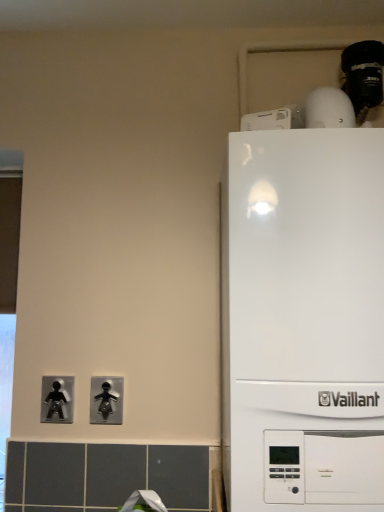
What do you see at coordinates (303, 320) in the screenshot? The image size is (384, 512). I see `white glossy boiler at right` at bounding box center [303, 320].

What do you see at coordinates (57, 399) in the screenshot? I see `metallic silver figure at lower left, arranged as the 2th light switch when viewed from the right` at bounding box center [57, 399].

Locate an element on the screen. metallic silver figure at lower left, which is the 1th light switch in left-to-right order is located at coordinates (57, 399).

At what (x,y) coordinates should I click in order to perform the action: click on black plastic light switch at lower center, the second light switch from the left. Please return your answer as a coordinate pair (x, y). This screenshot has width=384, height=512. Looking at the image, I should click on (106, 400).

Where is `white glossy boiler at right`? Image resolution: width=384 pixels, height=512 pixels. white glossy boiler at right is located at coordinates (303, 320).

Between metallic silver figure at lower left, arranged as the 2th light switch when viewed from the right, and black plastic light switch at lower center, the second light switch from the left, which one has more height?

metallic silver figure at lower left, arranged as the 2th light switch when viewed from the right.

Is black plastic light switch at lower center, the second light switch from the left, at the back of metallic silver figure at lower left, arranged as the 2th light switch when viewed from the right?

That's not correct — metallic silver figure at lower left, arranged as the 2th light switch when viewed from the right, is not looking away from black plastic light switch at lower center, the second light switch from the left.

In the scene shown: From a real-world perspective, is metallic silver figure at lower left, which is the 1th light switch in left-to-right order, located higher than black plastic light switch at lower center, the second light switch from the left?

Yes, from a real-world perspective, metallic silver figure at lower left, which is the 1th light switch in left-to-right order, is over black plastic light switch at lower center, the second light switch from the left

Is metallic silver figure at lower left, which is the 1th light switch in left-to-right order, far from black plastic light switch at lower center, which is the first light switch in right-to-left order?

They are positioned close to each other.

Consider the image. Is black plastic light switch at lower center, the second light switch from the left, looking in the opposite direction of metallic silver figure at lower left, arranged as the 2th light switch when viewed from the right?

No, black plastic light switch at lower center, the second light switch from the left, is not facing away from metallic silver figure at lower left, arranged as the 2th light switch when viewed from the right.

Considering the sizes of objects black plastic light switch at lower center, which is the first light switch in right-to-left order, and metallic silver figure at lower left, arranged as the 2th light switch when viewed from the right, in the image provided, who is bigger, black plastic light switch at lower center, which is the first light switch in right-to-left order, or metallic silver figure at lower left, arranged as the 2th light switch when viewed from the right,?

metallic silver figure at lower left, arranged as the 2th light switch when viewed from the right, is bigger.

Who is taller, black plastic light switch at lower center, which is the first light switch in right-to-left order, or metallic silver figure at lower left, which is the 1th light switch in left-to-right order?

With more height is metallic silver figure at lower left, which is the 1th light switch in left-to-right order.

Is black plastic light switch at lower center, which is the first light switch in right-to-left order, not inside metallic silver figure at lower left, arranged as the 2th light switch when viewed from the right?

Absolutely, black plastic light switch at lower center, which is the first light switch in right-to-left order, is external to metallic silver figure at lower left, arranged as the 2th light switch when viewed from the right.

Do you think white glossy boiler at right is within metallic silver figure at lower left, which is the 1th light switch in left-to-right order, or outside of it?

white glossy boiler at right is spatially situated outside metallic silver figure at lower left, which is the 1th light switch in left-to-right order.

At what (x,y) coordinates should I click in order to perform the action: click on the 2nd light switch behind when counting from the white glossy boiler at right. Please return your answer as a coordinate pair (x, y). Looking at the image, I should click on (57, 399).

From a real-world perspective, which object rests below the other?

From a 3D spatial view, metallic silver figure at lower left, arranged as the 2th light switch when viewed from the right, is below.

Considering the relative positions of white glossy boiler at right and metallic silver figure at lower left, which is the 1th light switch in left-to-right order, in the image provided, is white glossy boiler at right to the left of metallic silver figure at lower left, which is the 1th light switch in left-to-right order, from the viewer's perspective?

In fact, white glossy boiler at right is to the right of metallic silver figure at lower left, which is the 1th light switch in left-to-right order.

How far apart are metallic silver figure at lower left, which is the 1th light switch in left-to-right order, and white glossy boiler at right?

metallic silver figure at lower left, which is the 1th light switch in left-to-right order, is 25.44 inches away from white glossy boiler at right.

Considering the relative sizes of metallic silver figure at lower left, arranged as the 2th light switch when viewed from the right, and white glossy boiler at right in the image provided, is metallic silver figure at lower left, arranged as the 2th light switch when viewed from the right, thinner than white glossy boiler at right?

Correct, the width of metallic silver figure at lower left, arranged as the 2th light switch when viewed from the right, is less than that of white glossy boiler at right.

From a real-world perspective, is metallic silver figure at lower left, which is the 1th light switch in left-to-right order, physically located above or below white glossy boiler at right?

From a real-world perspective, metallic silver figure at lower left, which is the 1th light switch in left-to-right order, is physically below white glossy boiler at right.

Is metallic silver figure at lower left, arranged as the 2th light switch when viewed from the right, bigger than white glossy boiler at right?

No, metallic silver figure at lower left, arranged as the 2th light switch when viewed from the right, is not bigger than white glossy boiler at right.

Is white glossy boiler at right looking in the opposite direction of black plastic light switch at lower center, the second light switch from the left?

No, white glossy boiler at right's orientation is not away from black plastic light switch at lower center, the second light switch from the left.

Is white glossy boiler at right bigger than black plastic light switch at lower center, the second light switch from the left?

Yes.

Between white glossy boiler at right and black plastic light switch at lower center, the second light switch from the left, which one appears on the right side from the viewer's perspective?

From the viewer's perspective, white glossy boiler at right appears more on the right side.

Between black plastic light switch at lower center, the second light switch from the left, and white glossy boiler at right, which one is positioned in front?

white glossy boiler at right is closer to the camera.

From a real-world perspective, which object rests below the other?

black plastic light switch at lower center, the second light switch from the left.

Is black plastic light switch at lower center, the second light switch from the left, spatially inside white glossy boiler at right, or outside of it?

black plastic light switch at lower center, the second light switch from the left, exists outside the volume of white glossy boiler at right.

Find the location of a particular element. light switch above the black plastic light switch at lower center, the second light switch from the left (from a real-world perspective) is located at coordinates (57, 399).

I want to click on light switch to the right of metallic silver figure at lower left, arranged as the 2th light switch when viewed from the right, so click(106, 400).

Based on their spatial positions, is black plastic light switch at lower center, the second light switch from the left, or metallic silver figure at lower left, which is the 1th light switch in left-to-right order, closer to white glossy boiler at right?

black plastic light switch at lower center, the second light switch from the left, is positioned closer to the anchor white glossy boiler at right.

When comparing their distances from white glossy boiler at right, does metallic silver figure at lower left, which is the 1th light switch in left-to-right order, or black plastic light switch at lower center, the second light switch from the left, seem further?

Among the two, metallic silver figure at lower left, which is the 1th light switch in left-to-right order, is located further to white glossy boiler at right.

Which object lies nearer to the anchor point black plastic light switch at lower center, which is the first light switch in right-to-left order, metallic silver figure at lower left, which is the 1th light switch in left-to-right order, or white glossy boiler at right?

The object closer to black plastic light switch at lower center, which is the first light switch in right-to-left order, is metallic silver figure at lower left, which is the 1th light switch in left-to-right order.

When comparing their distances from metallic silver figure at lower left, arranged as the 2th light switch when viewed from the right, does black plastic light switch at lower center, which is the first light switch in right-to-left order, or white glossy boiler at right seem closer?

The object closer to metallic silver figure at lower left, arranged as the 2th light switch when viewed from the right, is black plastic light switch at lower center, which is the first light switch in right-to-left order.

Looking at the image, which one is located closer to black plastic light switch at lower center, the second light switch from the left, white glossy boiler at right or metallic silver figure at lower left, arranged as the 2th light switch when viewed from the right?

Based on the image, metallic silver figure at lower left, arranged as the 2th light switch when viewed from the right, appears to be nearer to black plastic light switch at lower center, the second light switch from the left.

Which object lies nearer to the anchor point metallic silver figure at lower left, arranged as the 2th light switch when viewed from the right, white glossy boiler at right or black plastic light switch at lower center, the second light switch from the left?

black plastic light switch at lower center, the second light switch from the left, lies closer to metallic silver figure at lower left, arranged as the 2th light switch when viewed from the right, than the other object.

The width and height of the screenshot is (384, 512). In order to click on light switch situated between metallic silver figure at lower left, arranged as the 2th light switch when viewed from the right, and white glossy boiler at right from left to right in this screenshot , I will do `click(106, 400)`.